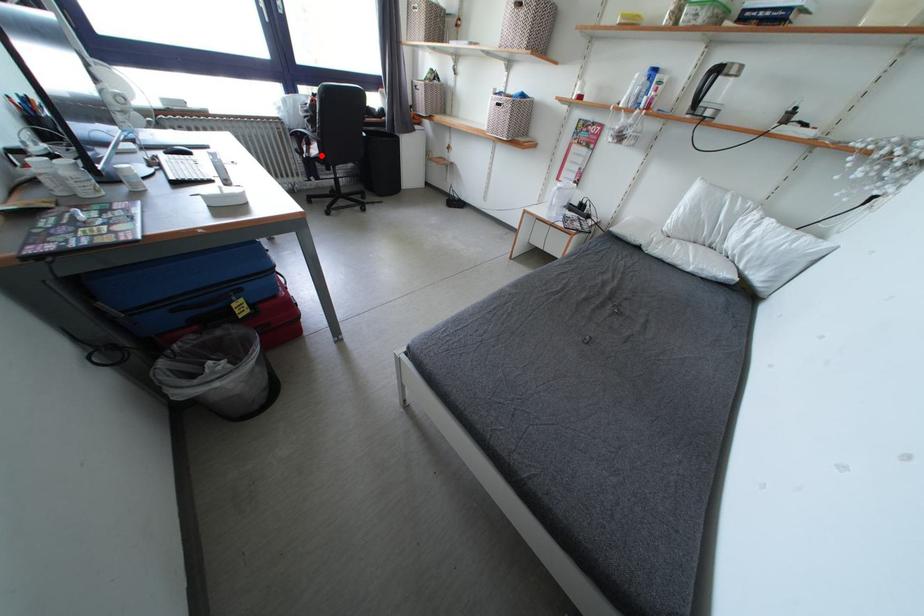
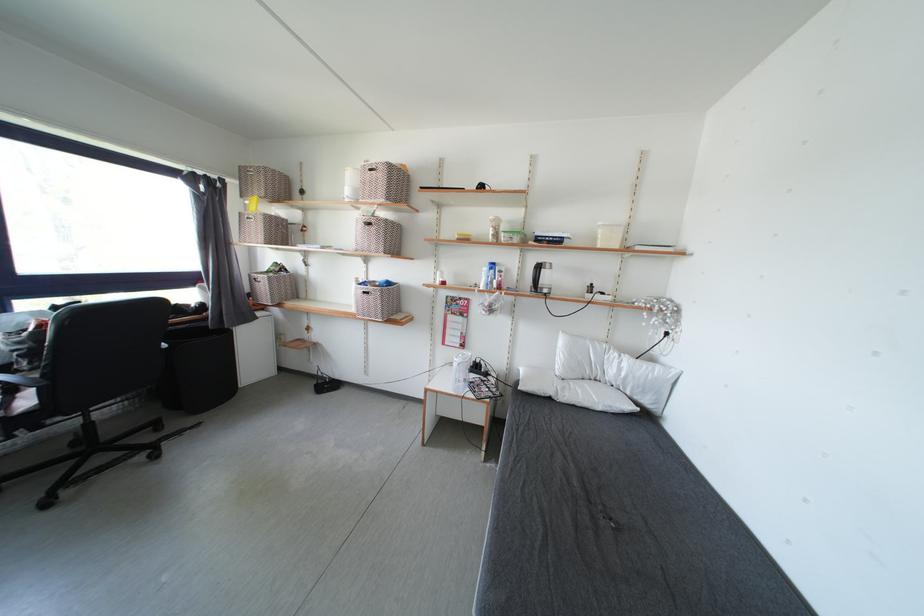
Where in the second image is the point corresponding to the highlighted location from the first image?

(33, 407)